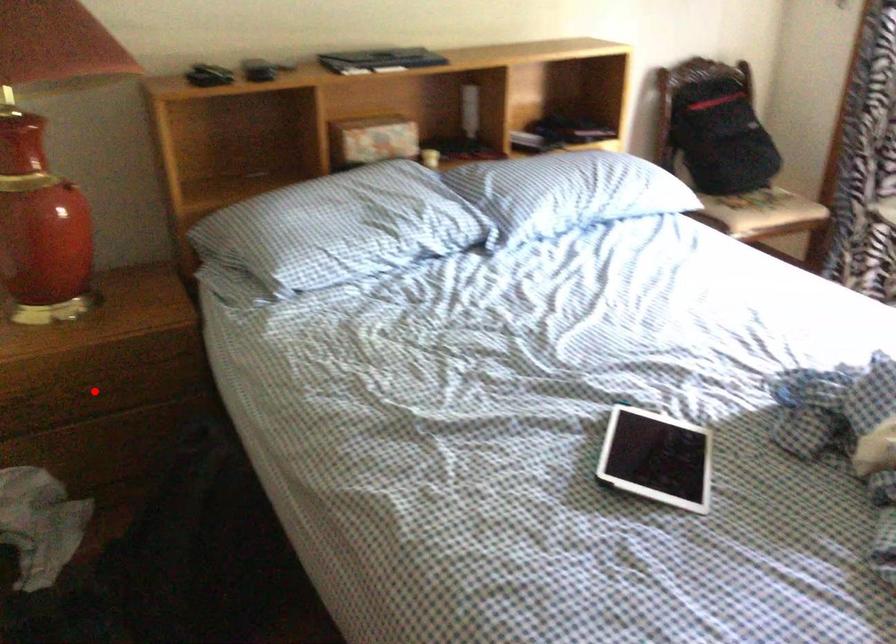
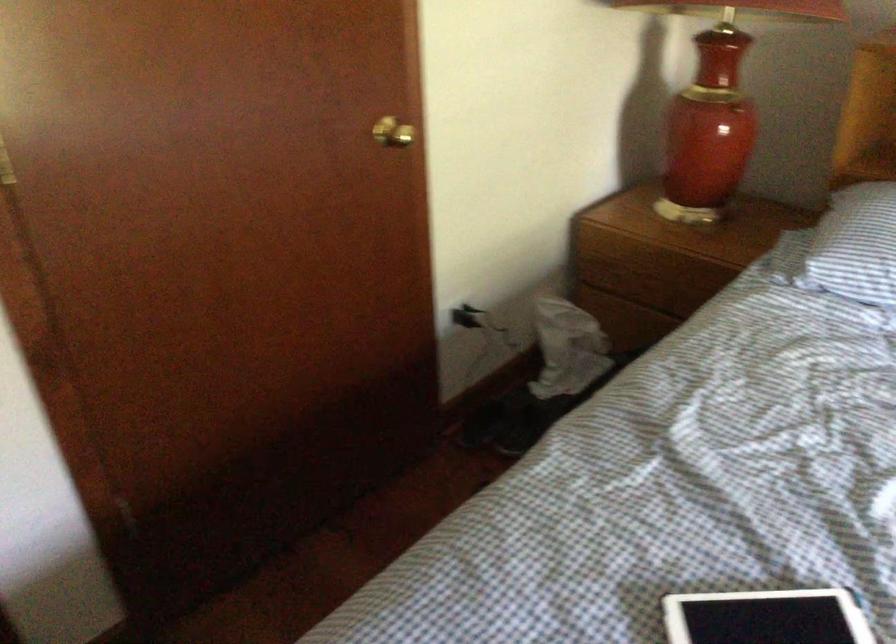
The point at the highlighted location is marked in the first image. Where is the corresponding point in the second image?

(650, 283)